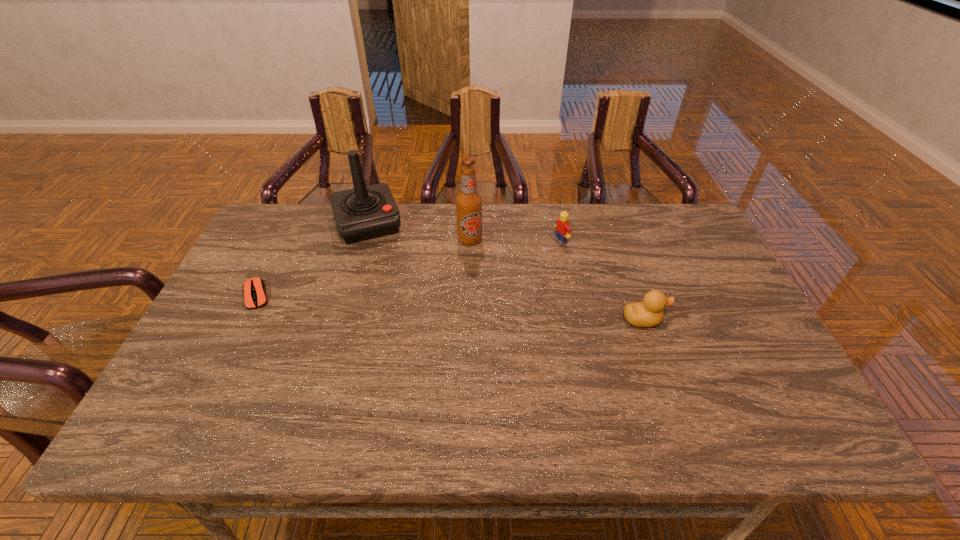
Where is `free point located on the front label of the third object from right to left`? The width and height of the screenshot is (960, 540). free point located on the front label of the third object from right to left is located at coordinates (479, 272).

Locate an element on the screen. blank area located on the front-facing side of the Lego is located at coordinates pos(453,287).

Where is `vacant space positioned 0.140m on the front-facing side of the Lego`? The width and height of the screenshot is (960, 540). vacant space positioned 0.140m on the front-facing side of the Lego is located at coordinates (517, 260).

Where is `free space located 0.180m on the front-facing side of the Lego`? The width and height of the screenshot is (960, 540). free space located 0.180m on the front-facing side of the Lego is located at coordinates (507, 265).

Find the location of a particular element. Image resolution: width=960 pixels, height=540 pixels. blank space located on the front-facing side of the joystick is located at coordinates (396, 305).

Find the location of a particular element. free space located 0.370m on the front-facing side of the joystick is located at coordinates (404, 332).

This screenshot has width=960, height=540. I want to click on free space located on the front-facing side of the joystick, so click(406, 338).

In order to click on beer bottle situated at the far edge in this screenshot , I will do `click(469, 202)`.

This screenshot has width=960, height=540. Identify the location of Lego situated at the far edge. (563, 230).

Locate an element on the screen. joystick that is at the far edge is located at coordinates (365, 212).